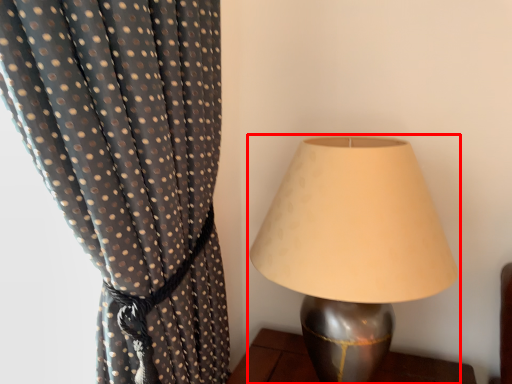
Question: From the image's perspective, considering the relative positions of lamp (annotated by the red box) and curtain in the image provided, where is lamp (annotated by the red box) located with respect to the staircase?

Choices:
 (A) above
 (B) below

Answer: (B)